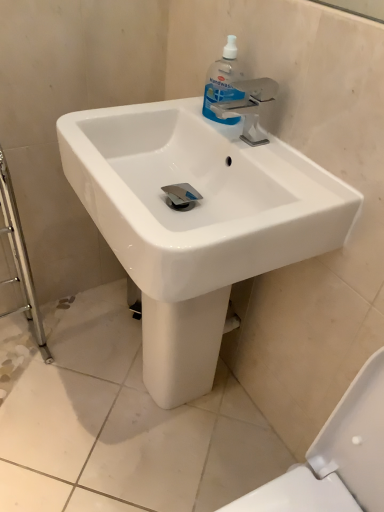
Question: Is clear plastic handwash at upper center taller or shorter than white glossy sink at center?

Choices:
 (A) short
 (B) tall

Answer: (A)

Question: Based on their positions, is clear plastic handwash at upper center located to the left or right of white glossy sink at center?

Choices:
 (A) left
 (B) right

Answer: (B)

Question: Which is correct: clear plastic handwash at upper center is inside white glossy sink at center, or outside of it?

Choices:
 (A) inside
 (B) outside

Answer: (A)

Question: From a real-world perspective, is white glossy sink at center above or below clear plastic handwash at upper center?

Choices:
 (A) above
 (B) below

Answer: (B)

Question: Is point (130, 128) closer or farther from the camera than point (218, 82)?

Choices:
 (A) farther
 (B) closer

Answer: (A)

Question: Is white glossy sink at center situated inside clear plastic handwash at upper center or outside?

Choices:
 (A) outside
 (B) inside

Answer: (A)

Question: From their relative heights in the image, would you say white glossy sink at center is taller or shorter than clear plastic handwash at upper center?

Choices:
 (A) tall
 (B) short

Answer: (A)